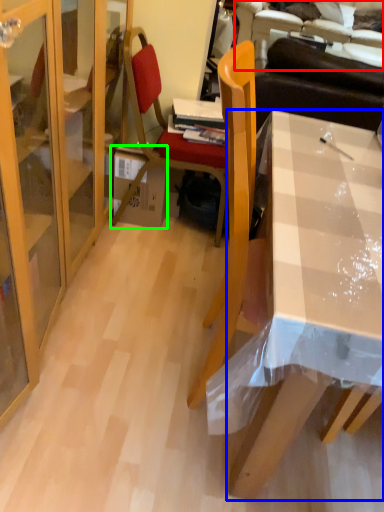
Question: Which object is the closest to the couch (highlighted by a red box)? Choose among these: desk (highlighted by a blue box) or box (highlighted by a green box).

Choices:
 (A) desk
 (B) box

Answer: (B)